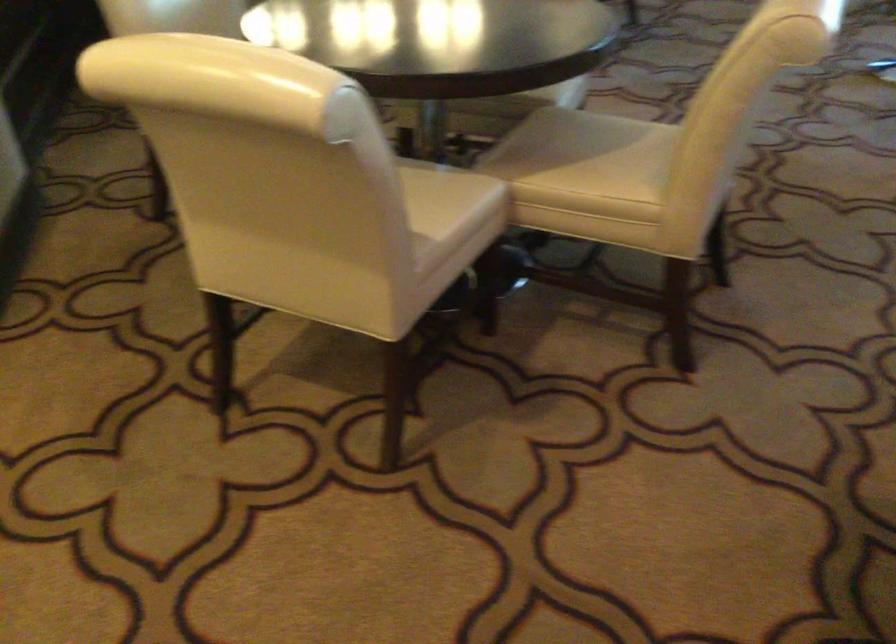
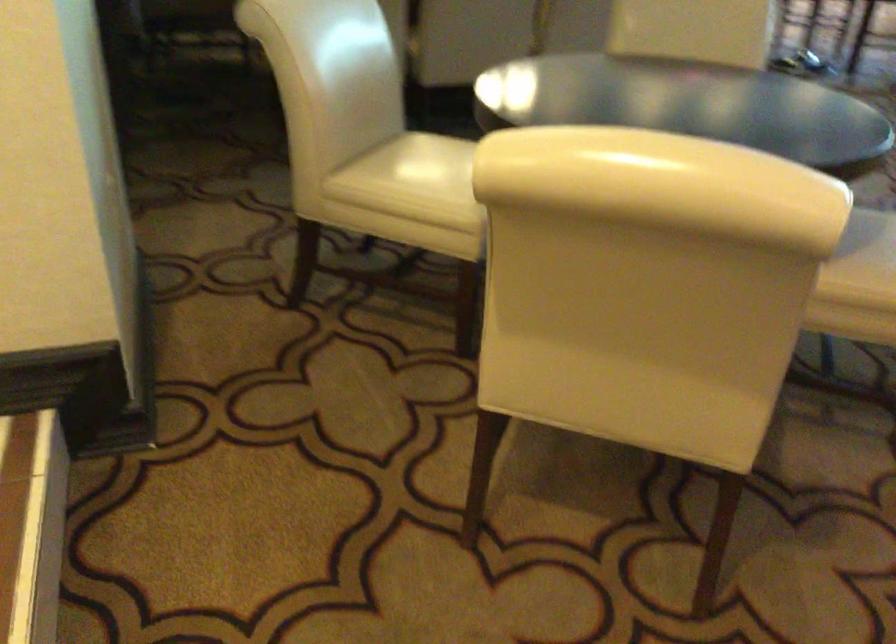
Question: The first image is from the beginning of the video and the second image is from the end. How did the camera likely rotate when shooting the video?

Choices:
 (A) Left
 (B) Right
 (C) Up
 (D) Down

Answer: (B)